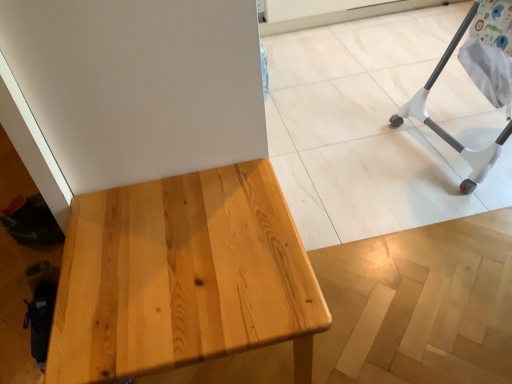
Image resolution: width=512 pixels, height=384 pixels. In order to click on spots to the right of natural wood table at center in this screenshot , I will do click(x=378, y=291).